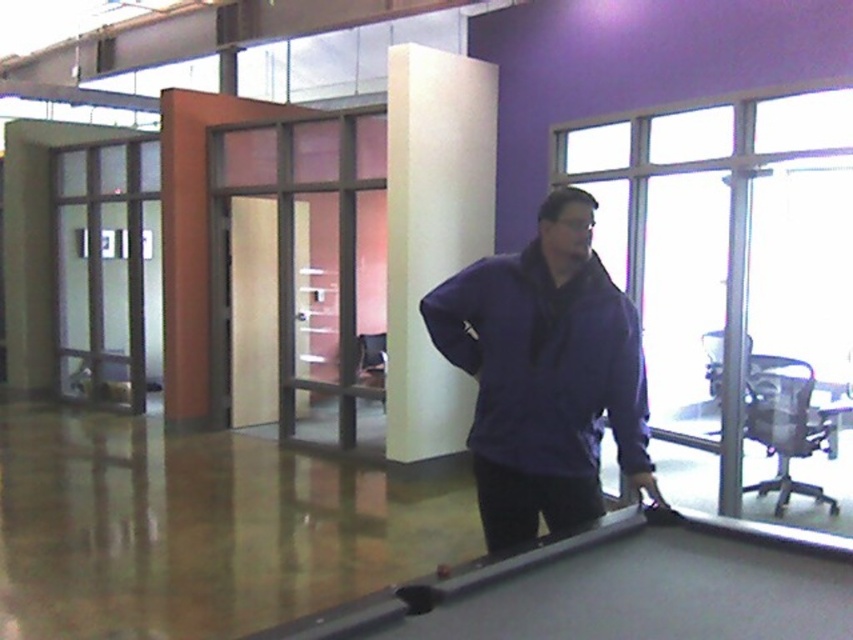
Question: Is purple matte jacket at center wider than white matte pillar at center?

Choices:
 (A) yes
 (B) no

Answer: (B)

Question: In this image, where is purple matte jacket at center located relative to smooth black pool table at center?

Choices:
 (A) above
 (B) below

Answer: (A)

Question: Among these objects, which one is farthest from the camera?

Choices:
 (A) white matte pillar at center
 (B) purple matte jacket at center
 (C) smooth black pool table at center

Answer: (A)

Question: In this image, where is smooth black pool table at center located relative to white matte pillar at center?

Choices:
 (A) below
 (B) above

Answer: (A)

Question: Which point appears farthest from the camera in this image?

Choices:
 (A) (x=532, y=564)
 (B) (x=514, y=384)

Answer: (B)

Question: Which point is farther to the camera?

Choices:
 (A) white matte pillar at center
 (B) purple matte jacket at center
 (C) smooth black pool table at center

Answer: (A)